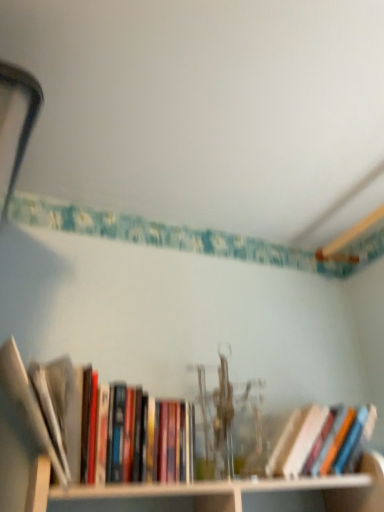
Question: Is hardcover book at center, positioned as the first book in right-to-left order, inside or outside of white wood cabinet at lower center?

Choices:
 (A) inside
 (B) outside

Answer: (A)

Question: Considering the relative positions of hardcover book at center, positioned as the first book in right-to-left order, and white wood cabinet at lower center in the image provided, is hardcover book at center, positioned as the first book in right-to-left order, to the left or to the right of white wood cabinet at lower center?

Choices:
 (A) right
 (B) left

Answer: (A)

Question: Considering the real-world distances, which object is closest to the hardcover book at center, positioned as the first book in right-to-left order?

Choices:
 (A) hardcover books at left, the 2th book from the right
 (B) white wood cabinet at lower center

Answer: (B)

Question: Which object is the farthest from the hardcover book at center, positioned as the first book in right-to-left order?

Choices:
 (A) white wood cabinet at lower center
 (B) hardcover books at left, the 2th book from the right

Answer: (B)